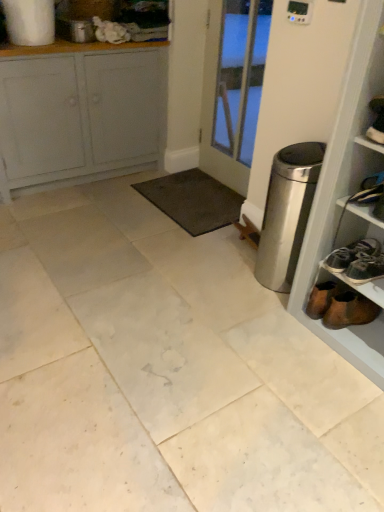
Question: Considering the relative positions of stainless steel trash can at right and white painted wood cabinet at upper left in the image provided, is stainless steel trash can at right to the left of white painted wood cabinet at upper left from the viewer's perspective?

Choices:
 (A) yes
 (B) no

Answer: (B)

Question: Is stainless steel trash can at right facing towards white painted wood cabinet at upper left?

Choices:
 (A) yes
 (B) no

Answer: (B)

Question: Can you confirm if stainless steel trash can at right is thinner than white painted wood cabinet at upper left?

Choices:
 (A) no
 (B) yes

Answer: (B)

Question: Could white painted wood cabinet at upper left be considered to be inside stainless steel trash can at right?

Choices:
 (A) no
 (B) yes

Answer: (A)

Question: From the image's perspective, is stainless steel trash can at right over white painted wood cabinet at upper left?

Choices:
 (A) yes
 (B) no

Answer: (B)

Question: Is stainless steel trash can at right bigger than white painted wood cabinet at upper left?

Choices:
 (A) yes
 (B) no

Answer: (B)

Question: Is dark gray carpet at center not within stainless steel trash can at right?

Choices:
 (A) yes
 (B) no

Answer: (A)

Question: Is dark gray carpet at center directly adjacent to stainless steel trash can at right?

Choices:
 (A) no
 (B) yes

Answer: (A)

Question: From the image's perspective, would you say dark gray carpet at center is shown under stainless steel trash can at right?

Choices:
 (A) no
 (B) yes

Answer: (A)

Question: Considering the relative sizes of dark gray carpet at center and stainless steel trash can at right in the image provided, is dark gray carpet at center thinner than stainless steel trash can at right?

Choices:
 (A) no
 (B) yes

Answer: (A)

Question: From a real-world perspective, is dark gray carpet at center positioned over stainless steel trash can at right based on gravity?

Choices:
 (A) no
 (B) yes

Answer: (A)

Question: Does dark gray carpet at center turn towards stainless steel trash can at right?

Choices:
 (A) yes
 (B) no

Answer: (B)

Question: Is white painted wood cabinet at upper left facing towards white marble tile at center?

Choices:
 (A) yes
 (B) no

Answer: (A)